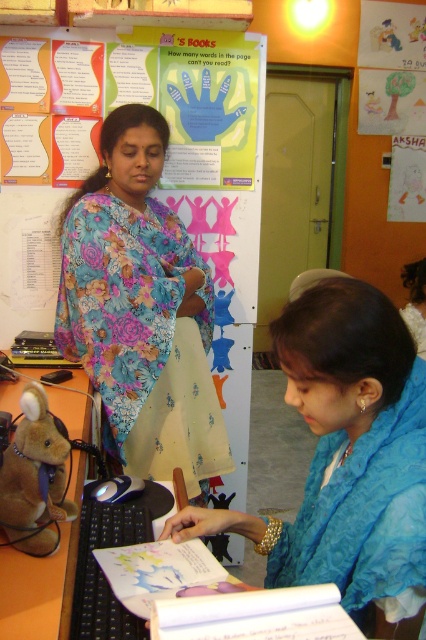
Question: Is floral fabric saree at center behind brown plush toy at lower left?

Choices:
 (A) yes
 (B) no

Answer: (A)

Question: Can you confirm if blue fabric scarf at lower right is positioned above brown plush toy at lower left?

Choices:
 (A) no
 (B) yes

Answer: (B)

Question: Among these objects, which one is farthest from the camera?

Choices:
 (A) floral fabric saree at center
 (B) blue fabric scarf at lower right
 (C) brown plush toy at lower left

Answer: (A)

Question: Considering the real-world distances, which object is farthest from the brown plush toy at lower left?

Choices:
 (A) blue fabric scarf at lower right
 (B) floral fabric saree at center

Answer: (A)

Question: From the image, what is the correct spatial relationship of blue fabric scarf at lower right in relation to brown plush toy at lower left?

Choices:
 (A) right
 (B) left

Answer: (A)

Question: Which of these objects is positioned farthest from the floral fabric saree at center?

Choices:
 (A) brown plush toy at lower left
 (B) blue fabric scarf at lower right

Answer: (B)